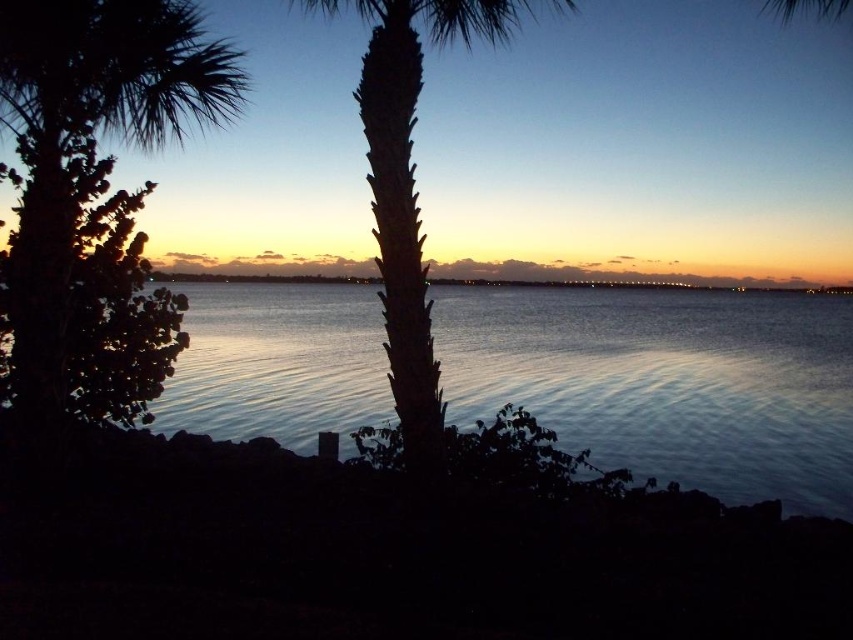
Question: Can you confirm if silvery reflective water at center is positioned above dark green textured palm tree at center?

Choices:
 (A) yes
 (B) no

Answer: (B)

Question: Which object is closer to the camera taking this photo?

Choices:
 (A) silvery reflective water at center
 (B) dark green textured palm tree at center
 (C) green leafy palm tree at upper left

Answer: (B)

Question: Does silvery reflective water at center appear under green leafy palm tree at upper left?

Choices:
 (A) no
 (B) yes

Answer: (B)

Question: Which point is closer to the camera taking this photo?

Choices:
 (A) (223, 289)
 (B) (25, 260)
 (C) (514, 10)

Answer: (B)

Question: Is silvery reflective water at center wider than dark green textured palm tree at center?

Choices:
 (A) no
 (B) yes

Answer: (B)

Question: Among these objects, which one is farthest from the camera?

Choices:
 (A) green leafy palm tree at upper left
 (B) silvery reflective water at center
 (C) dark green textured palm tree at center

Answer: (B)